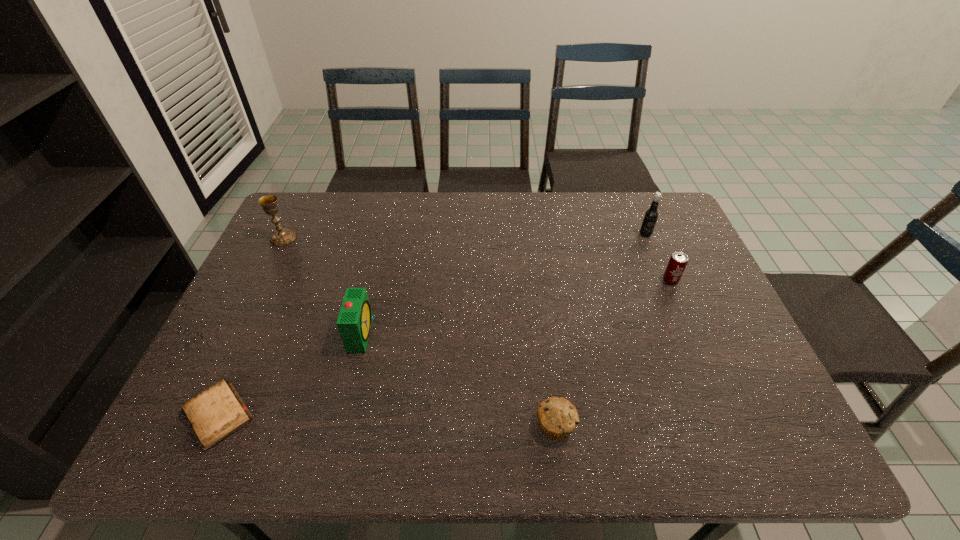
Where is `free space located 0.260m on the right of the chalice`? The width and height of the screenshot is (960, 540). free space located 0.260m on the right of the chalice is located at coordinates (379, 238).

Where is `vacant space located on the front-facing side of the alarm clock`? vacant space located on the front-facing side of the alarm clock is located at coordinates (523, 334).

Locate an element on the screen. free space located on the left of the third shortest object is located at coordinates (631, 280).

In order to click on vacant region located 0.160m on the left of the muffin in this screenshot , I will do `click(461, 425)`.

Image resolution: width=960 pixels, height=540 pixels. Find the location of `free spot located 0.130m on the back of the diary`. free spot located 0.130m on the back of the diary is located at coordinates (253, 337).

In order to click on root beer located at the far edge in this screenshot , I will do `click(651, 215)`.

Find the location of `chalice at the far edge`. chalice at the far edge is located at coordinates (282, 236).

Find the location of `muffin situated at the near edge`. muffin situated at the near edge is located at coordinates (557, 417).

Identify the location of diary that is at the near edge. (218, 412).

What are the coordinates of `chalice that is at the left edge` in the screenshot? It's located at pyautogui.click(x=282, y=236).